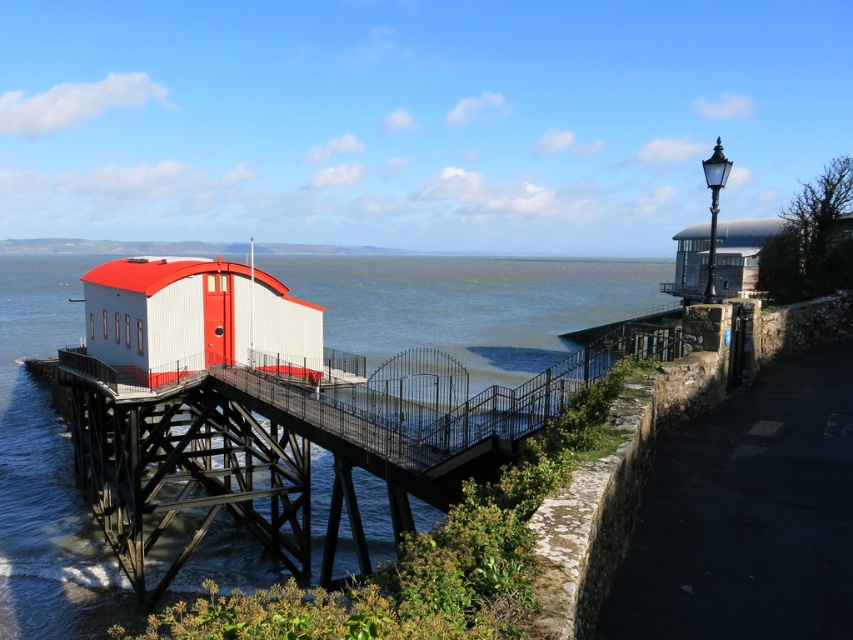
You are a photographer planning to capture the white matte bridge at center and the metallic silver building at upper right in a single shot. Given their sizes in the scene, which object will appear smaller in the final photo?

The white matte bridge at center will appear smaller in the final photo because it occupies less space than the metallic silver building at upper right.

You are standing on the wooden pier near the red and white boathouse and want to cross to the other side. The white matte bridge at center is your only option. Is the bridge directly in front of you, to your left, or to your right?

The white matte bridge at center is located at point (x=299, y=448), which is directly in front of you as it is at the center of the scene.